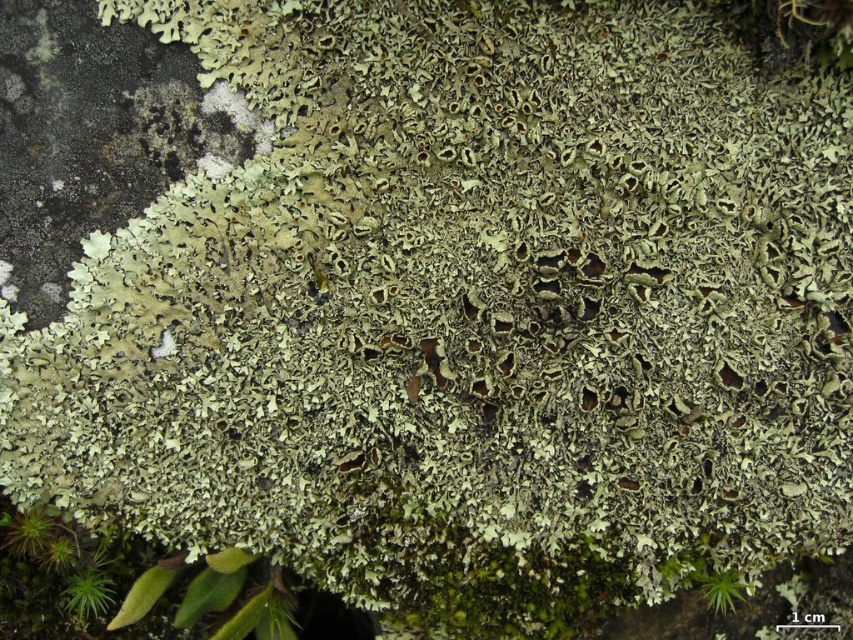
Does green fuzzy moss at lower left appear over green fuzzy moss at lower right?

No, green fuzzy moss at lower left is not above green fuzzy moss at lower right.

Who is more distant from viewer, (91, 579) or (723, 596)?

The point (91, 579) is behind.

Locate an element on the screen. green fuzzy moss at lower left is located at coordinates (86, 593).